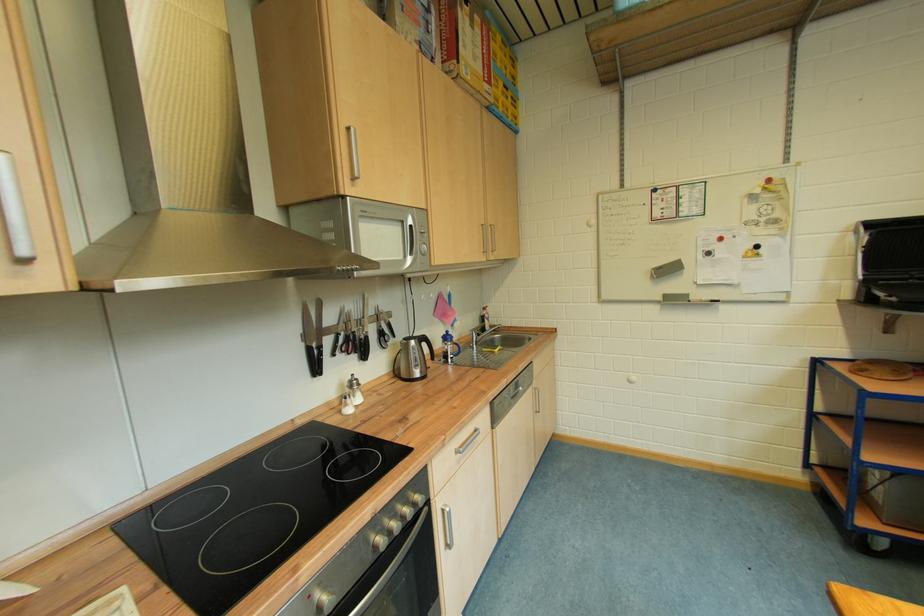
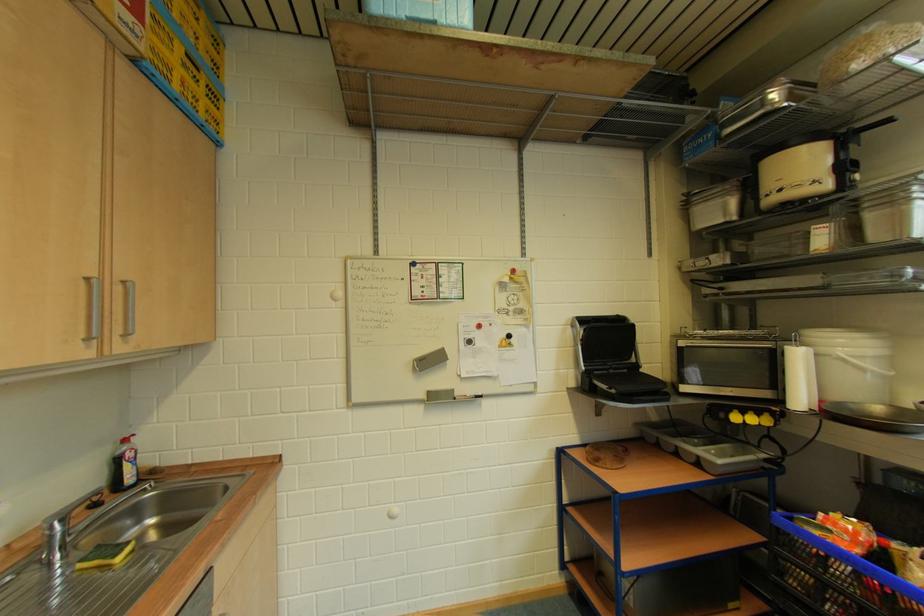
The point at (490, 228) is marked in the first image. Where is the corresponding point in the second image?

(94, 282)